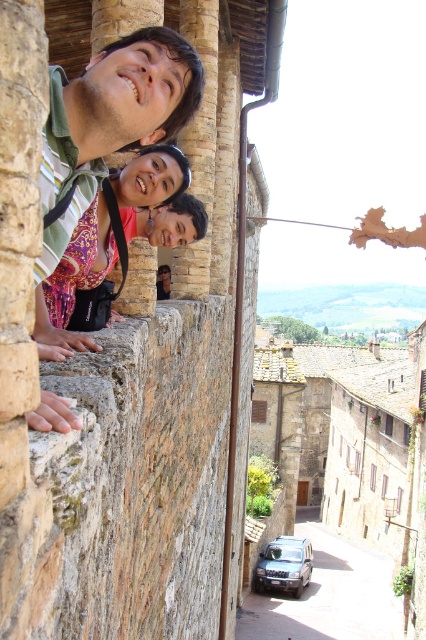
In order to click on matte black camera at upper left in this screenshot , I will do `click(132, 93)`.

Measure the distance between point (135, 65) and camera.

The distance of point (135, 65) from camera is 10.74 meters.

What do you see at coordinates (132, 93) in the screenshot?
I see `matte black camera at upper left` at bounding box center [132, 93].

Where is `matte black camera at upper left`? matte black camera at upper left is located at coordinates 132,93.